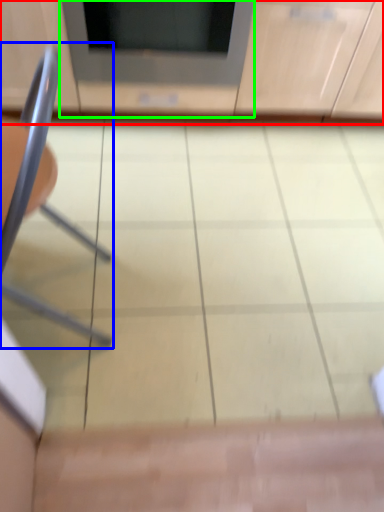
Question: Based on their relative distances, which object is farther from cabinetry (highlighted by a red box)? Choose from chair (highlighted by a blue box) and appliance (highlighted by a green box).

Choices:
 (A) chair
 (B) appliance

Answer: (A)